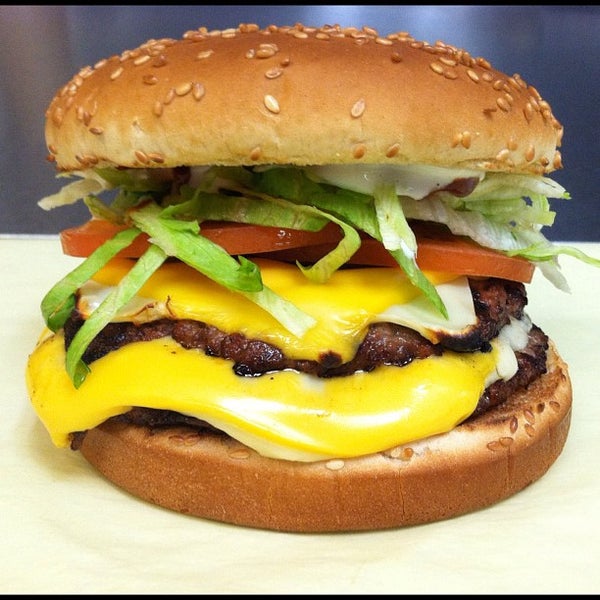
Locate an element on the screen. This screenshot has height=600, width=600. table is located at coordinates (161, 531).